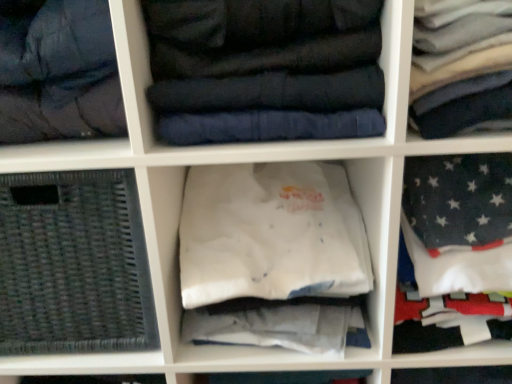
Question: Do you think white cotton shirt at upper right, marked as the third clothing in a left-to-right arrangement, is within dark blue quilted jacket at center, marked as the 1th clothing in a left-to-right arrangement, or outside of it?

Choices:
 (A) outside
 (B) inside

Answer: (A)

Question: In terms of height, does white cotton shirt at upper right, the 1th clothing positioned from the right, look taller or shorter compared to dark blue quilted jacket at center, acting as the third clothing starting from the right?

Choices:
 (A) short
 (B) tall

Answer: (A)

Question: Considering the real-world distances, which object is closest to the white cotton t-shirt at center, which is the second clothing in right-to-left order?

Choices:
 (A) dark gray quilted jacket at upper left
 (B) dark blue quilted jacket at center, marked as the 1th clothing in a left-to-right arrangement
 (C) black woven basket at lower left
 (D) white cotton shirt at upper right, marked as the third clothing in a left-to-right arrangement

Answer: (C)

Question: Which is nearer to the dark gray quilted jacket at upper left?

Choices:
 (A) white cotton shirt at upper right, the 1th clothing positioned from the right
 (B) white cotton t-shirt at center, acting as the 2th clothing starting from the left
 (C) black woven basket at lower left
 (D) dark blue quilted jacket at center, marked as the 1th clothing in a left-to-right arrangement

Answer: (D)